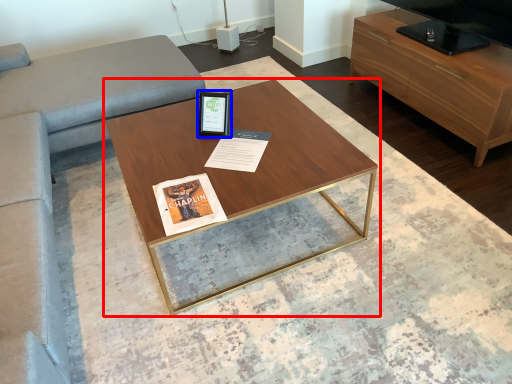
Question: Which object is further to the camera taking this photo, coffee table (highlighted by a red box) or picture frame (highlighted by a blue box)?

Choices:
 (A) coffee table
 (B) picture frame

Answer: (B)